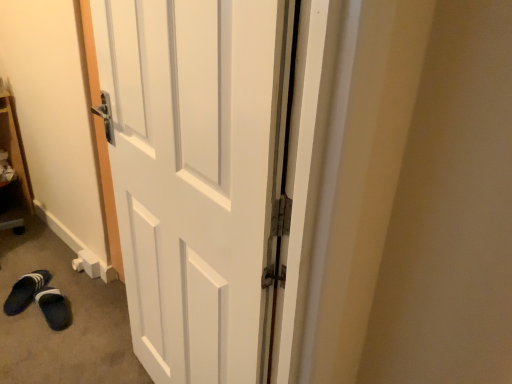
Question: Considering the positions of black fabric slipper at lower left, placed as the 1th footwear when sorted from left to right, and white matte door at center in the image, is black fabric slipper at lower left, placed as the 1th footwear when sorted from left to right, taller or shorter than white matte door at center?

Choices:
 (A) short
 (B) tall

Answer: (A)

Question: From the image's perspective, is black fabric slipper at lower left, arranged as the 2th footwear when viewed from the right, above or below white matte door at center?

Choices:
 (A) below
 (B) above

Answer: (A)

Question: Estimate the real-world distances between objects in this image. Which object is closer to the dark blue fabric slippers at lower left, the second footwear viewed from the left?

Choices:
 (A) white matte door at center
 (B) black fabric slipper at lower left, placed as the 1th footwear when sorted from left to right

Answer: (B)

Question: Which object is the farthest from the black fabric slipper at lower left, arranged as the 2th footwear when viewed from the right?

Choices:
 (A) dark blue fabric slippers at lower left, the second footwear viewed from the left
 (B) white matte door at center

Answer: (B)